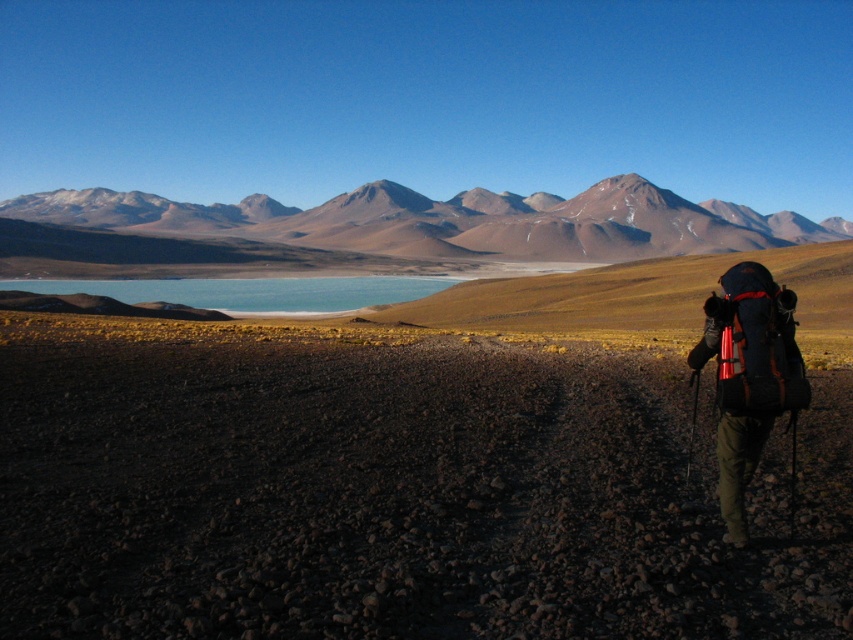
Who is shorter, smooth brown mountains at upper center or black nylon backpack at lower right?

With less height is black nylon backpack at lower right.

Can you confirm if smooth brown mountains at upper center is positioned below black nylon backpack at lower right?

No, smooth brown mountains at upper center is not below black nylon backpack at lower right.

The width and height of the screenshot is (853, 640). Describe the element at coordinates (447, 221) in the screenshot. I see `smooth brown mountains at upper center` at that location.

Find the location of a particular element. The width and height of the screenshot is (853, 640). smooth brown mountains at upper center is located at coordinates (447, 221).

Does black nylon backpack at lower right appear over matte black backpack at lower right?

Actually, black nylon backpack at lower right is below matte black backpack at lower right.

Who is taller, black nylon backpack at lower right or matte black backpack at lower right?

Standing taller between the two is black nylon backpack at lower right.

Locate an element on the screen. black nylon backpack at lower right is located at coordinates (747, 376).

Where is `black nylon backpack at lower right`? The width and height of the screenshot is (853, 640). black nylon backpack at lower right is located at coordinates (747, 376).

Is point (577, 218) closer to viewer compared to point (723, 340)?

That is False.

Who is positioned more to the left, smooth brown mountains at upper center or matte black backpack at lower right?

smooth brown mountains at upper center is more to the left.

Which is behind, point (16, 211) or point (734, 339)?

Positioned behind is point (16, 211).

The image size is (853, 640). Find the location of `smooth brown mountains at upper center`. smooth brown mountains at upper center is located at coordinates 447,221.